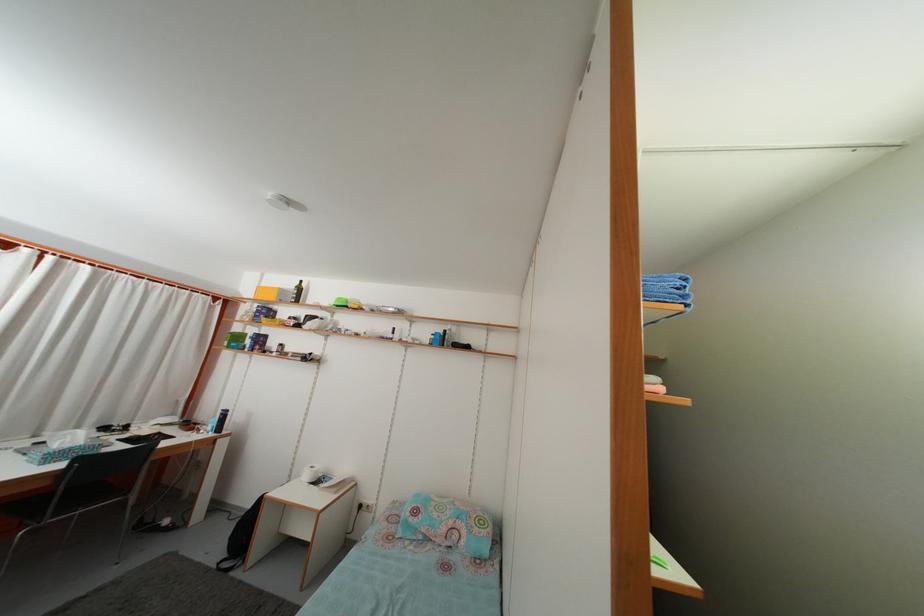
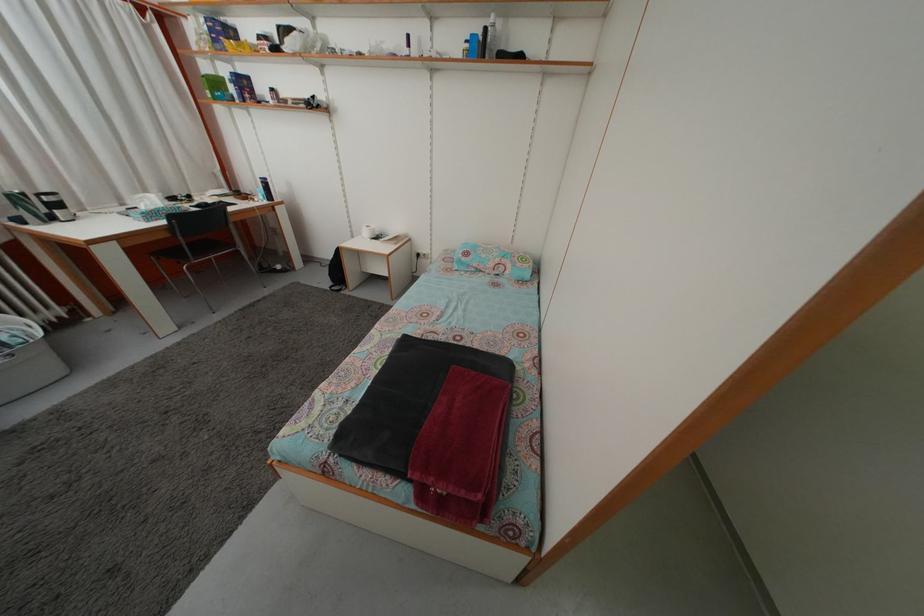
Where in the second image is the point corresponding to (439,344) from the first image?

(473, 53)